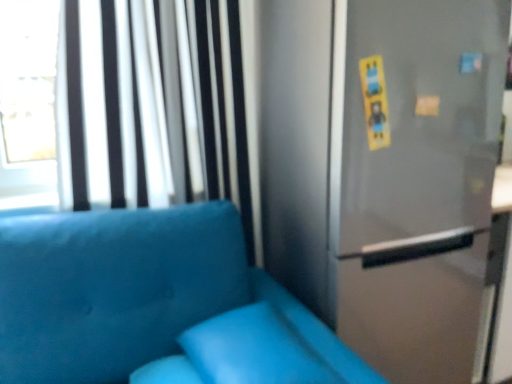
Question: In terms of width, does suede blue couch at lower left look wider or thinner when compared to satin silver screen door at upper right?

Choices:
 (A) thin
 (B) wide

Answer: (B)

Question: Considering the positions of point (324, 347) and point (370, 190), is point (324, 347) closer or farther from the camera than point (370, 190)?

Choices:
 (A) farther
 (B) closer

Answer: (B)

Question: Which object is the closest to the suede blue couch at lower left?

Choices:
 (A) white/textured curtain at upper left
 (B) satin silver fridge at right
 (C) matte blue pillow at lower center
 (D) satin silver screen door at upper right

Answer: (C)

Question: Based on their relative distances, which object is nearer to the white/textured curtain at upper left?

Choices:
 (A) matte blue pillow at lower center
 (B) satin silver fridge at right
 (C) suede blue couch at lower left
 (D) satin silver screen door at upper right

Answer: (C)